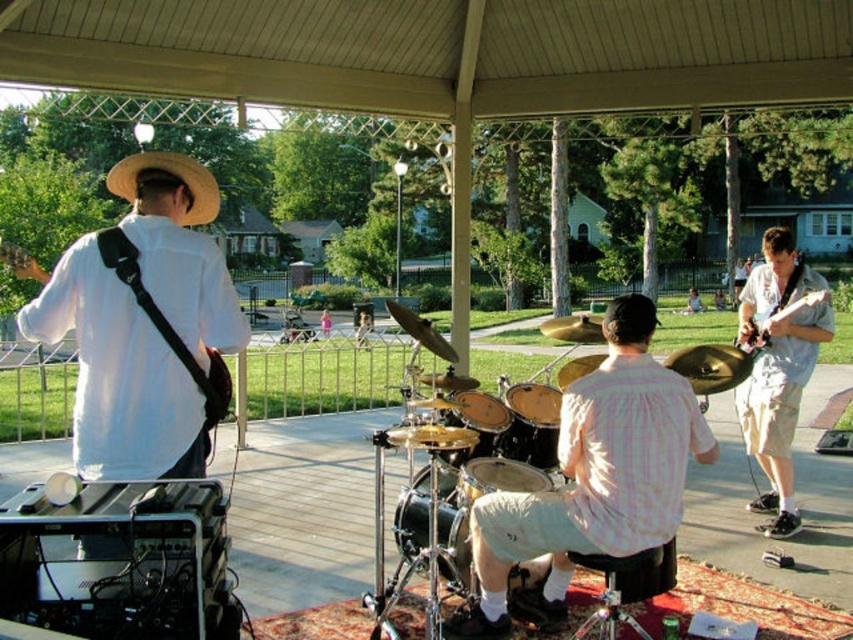
Which of these two, pink checkered shirt at center or black drum at center, stands taller?

Standing taller between the two is pink checkered shirt at center.

Who is more forward, (630, 340) or (457, 531)?

Point (630, 340) is more forward.

At what (x,y) coordinates should I click in order to perform the action: click on pink checkered shirt at center. Please return your answer as a coordinate pair (x, y). Image resolution: width=853 pixels, height=640 pixels. Looking at the image, I should click on (592, 477).

Is pink checkered shirt at center further to camera compared to straw hat at upper left?

Yes, pink checkered shirt at center is behind straw hat at upper left.

Is pink checkered shirt at center taller than straw hat at upper left?

In fact, pink checkered shirt at center may be shorter than straw hat at upper left.

Who is more forward, (505, 572) or (115, 172)?

Point (115, 172) is in front.

Where is `pink checkered shirt at center`? The width and height of the screenshot is (853, 640). pink checkered shirt at center is located at coordinates (592, 477).

Which is above, black drum at center or straw hat at upper left?

straw hat at upper left is above.

Does black drum at center have a greater width compared to straw hat at upper left?

In fact, black drum at center might be narrower than straw hat at upper left.

The image size is (853, 640). What are the coordinates of `black drum at center` in the screenshot? It's located at (451, 524).